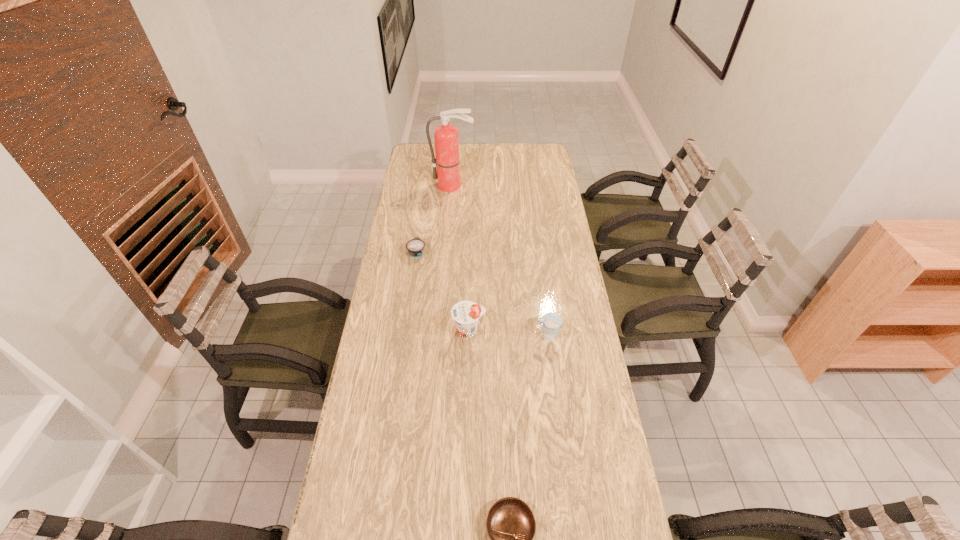
The image size is (960, 540). Identify the location of vacant region located 0.390m on the back of the third shortest object. (537, 253).

This screenshot has height=540, width=960. I want to click on blank space located 0.210m on the back of the shortest yogurt, so click(422, 214).

Locate an element on the screen. The width and height of the screenshot is (960, 540). fire extinguisher situated at the left edge is located at coordinates (446, 137).

What are the coordinates of `yogurt at the left edge` in the screenshot? It's located at (415, 247).

Where is `object that is at the right edge`? object that is at the right edge is located at coordinates (551, 321).

This screenshot has height=540, width=960. I want to click on vacant space at the left edge of the desktop, so click(412, 298).

Find the location of a particular element. The height and width of the screenshot is (540, 960). vacant space at the right edge of the desktop is located at coordinates (587, 355).

Where is `vacant space at the far left corner`? vacant space at the far left corner is located at coordinates (409, 164).

In order to click on free space that is in between the rightmost yogurt and the tallest yogurt in this screenshot , I will do `click(509, 334)`.

I want to click on free point between the leftmost yogurt and the rightmost object, so click(x=482, y=294).